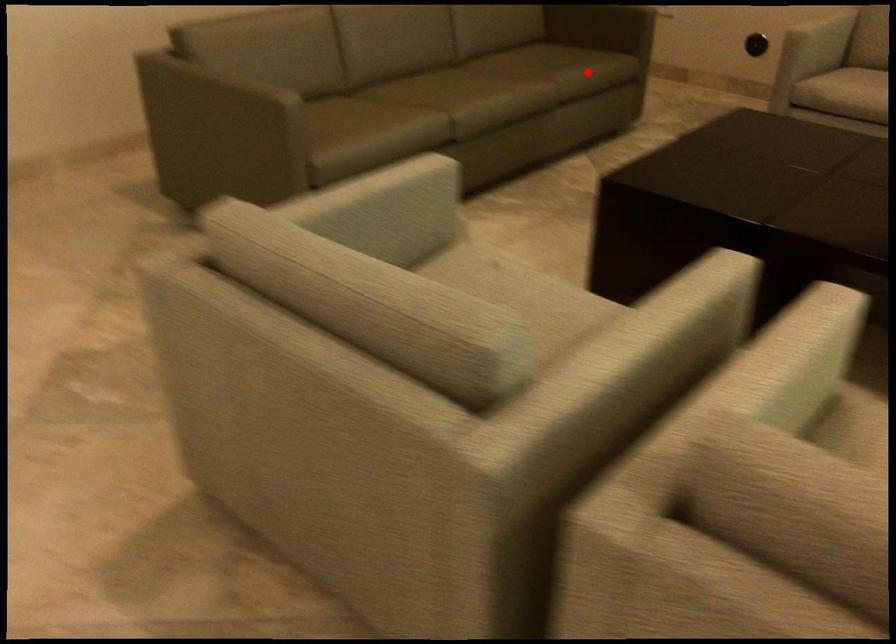
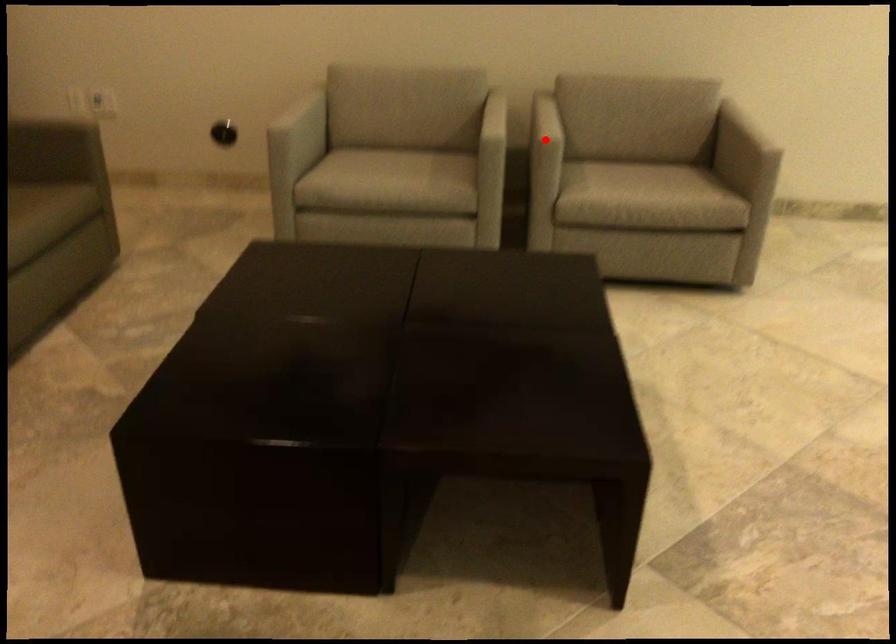
I am providing you with two images of the same scene from different viewpoints. A red point is marked on the first image and another point is marked on the second image. Is the red point in image1 aligned with the point shown in image2?

No